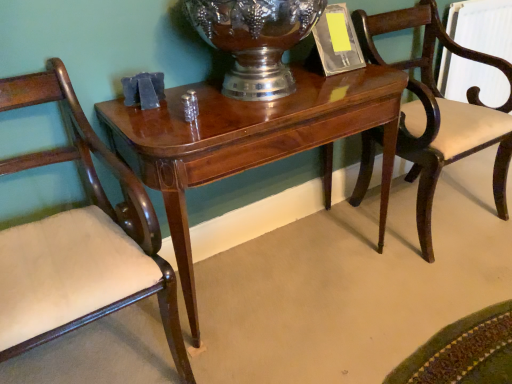
Find the location of a particular element. Image resolution: width=512 pixels, height=384 pixels. free area below mahogany wood chair at right, the first chair when ordered from right to left (from a real-world perspective) is located at coordinates (412, 214).